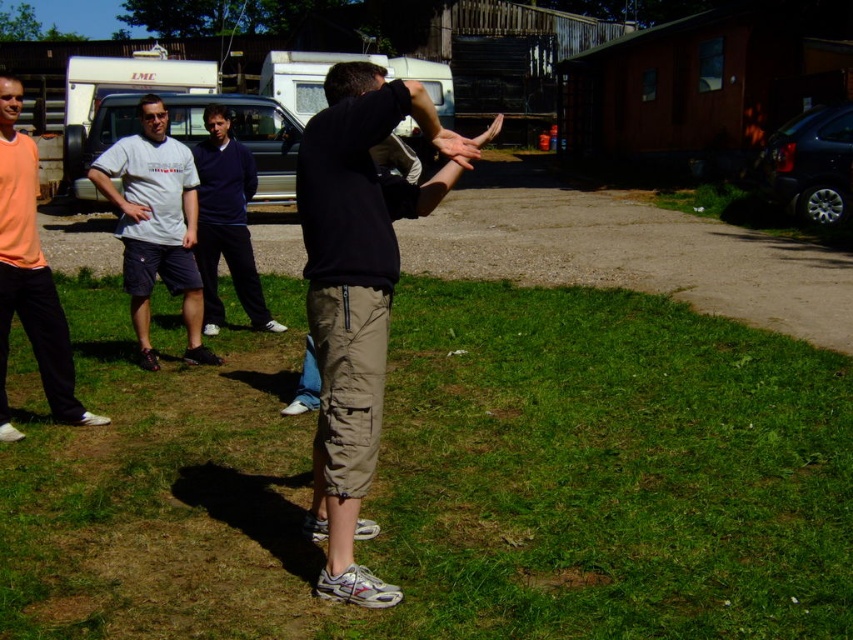
Is black cotton t-shirt at center taller than orange cotton shirt at left?

Correct, black cotton t-shirt at center is much taller as orange cotton shirt at left.

Can you confirm if black cotton t-shirt at center is positioned above orange cotton shirt at left?

Actually, black cotton t-shirt at center is below orange cotton shirt at left.

Is point (358, 74) farther from camera compared to point (0, 301)?

That is False.

Locate an element on the screen. The image size is (853, 640). black cotton t-shirt at center is located at coordinates (357, 294).

Looking at this image, which is more to the right, green grass at center or orange cotton shirt at left?

green grass at center is more to the right.

Between green grass at center and orange cotton shirt at left, which one is positioned higher?

orange cotton shirt at left is higher up.

This screenshot has height=640, width=853. Describe the element at coordinates (445, 480) in the screenshot. I see `green grass at center` at that location.

Identify the location of green grass at center. The image size is (853, 640). (445, 480).

Describe the element at coordinates (445, 480) in the screenshot. I see `green grass at center` at that location.

I want to click on green grass at center, so click(445, 480).